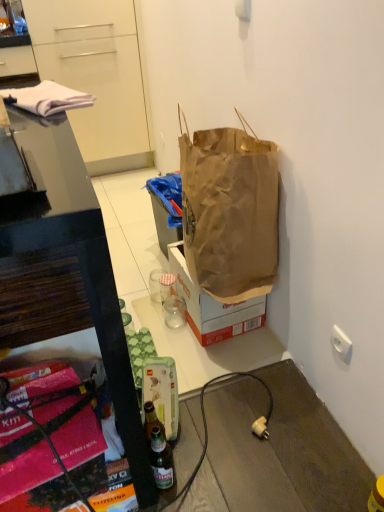
Question: Is white glossy cabinet at upper left next to clear glass cup at center, which is counted as the first coffee cup, starting from the back?

Choices:
 (A) yes
 (B) no

Answer: (B)

Question: Does white glossy cabinet at upper left have a greater height compared to clear glass cup at center, which appears as the second coffee cup when viewed from the front?

Choices:
 (A) no
 (B) yes

Answer: (B)

Question: Is white glossy cabinet at upper left positioned behind clear glass cup at center, which is counted as the first coffee cup, starting from the back?

Choices:
 (A) yes
 (B) no

Answer: (A)

Question: From a real-world perspective, is white glossy cabinet at upper left positioned over clear glass cup at center, which is counted as the first coffee cup, starting from the back, based on gravity?

Choices:
 (A) yes
 (B) no

Answer: (A)

Question: Considering the relative positions of white glossy cabinet at upper left and clear glass cup at center, which appears as the second coffee cup when viewed from the front, in the image provided, is white glossy cabinet at upper left to the left of clear glass cup at center, which appears as the second coffee cup when viewed from the front, from the viewer's perspective?

Choices:
 (A) no
 (B) yes

Answer: (B)

Question: Is clear glass cup at center, which is counted as the first coffee cup, starting from the back, inside white glossy cabinet at upper left?

Choices:
 (A) yes
 (B) no

Answer: (B)

Question: From the image's perspective, is white plastic power outlet at lower right located above brown paper bag at center?

Choices:
 (A) no
 (B) yes

Answer: (A)

Question: Could you tell me if white plastic power outlet at lower right is facing brown paper bag at center?

Choices:
 (A) no
 (B) yes

Answer: (B)

Question: Is white plastic power outlet at lower right not within brown paper bag at center?

Choices:
 (A) yes
 (B) no

Answer: (A)

Question: Can you confirm if white plastic power outlet at lower right is smaller than brown paper bag at center?

Choices:
 (A) no
 (B) yes

Answer: (B)

Question: Considering the relative positions of white plastic power outlet at lower right and brown paper bag at center in the image provided, is white plastic power outlet at lower right behind brown paper bag at center?

Choices:
 (A) yes
 (B) no

Answer: (B)

Question: Are white plastic power outlet at lower right and brown paper bag at center located far from each other?

Choices:
 (A) no
 (B) yes

Answer: (A)

Question: Is brown paper bag at center next to white cloth at upper left and touching it?

Choices:
 (A) yes
 (B) no

Answer: (B)